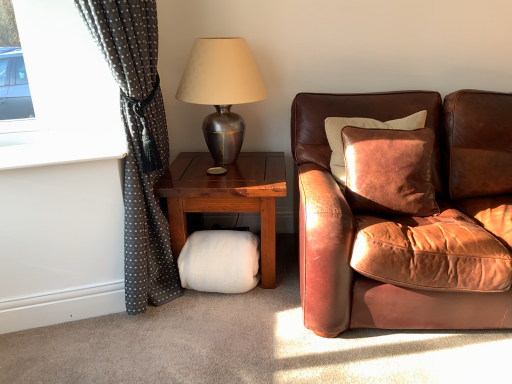
The height and width of the screenshot is (384, 512). I want to click on free space in front of white fluffy footrest at lower center, so pos(217,323).